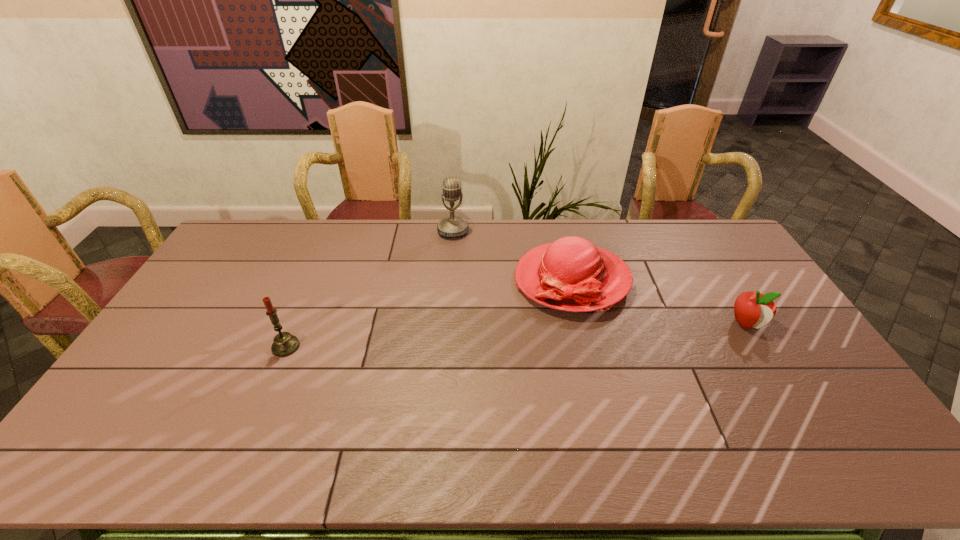
The height and width of the screenshot is (540, 960). What are the coordinates of `the leftmost object` in the screenshot? It's located at (285, 344).

Locate an element on the screen. The image size is (960, 540). candle is located at coordinates (285, 344).

Find the location of `apple`. apple is located at coordinates (752, 309).

Where is `the rightmost object`? Image resolution: width=960 pixels, height=540 pixels. the rightmost object is located at coordinates (752, 309).

Find the location of a particular element. The height and width of the screenshot is (540, 960). hat is located at coordinates (571, 274).

Where is `the second shortest object`? the second shortest object is located at coordinates (571, 274).

Identify the location of the second object from left to right. The height and width of the screenshot is (540, 960). (452, 226).

Locate an element on the screen. microphone is located at coordinates (452, 226).

I want to click on free space located on the back of the nearest object, so click(296, 325).

This screenshot has width=960, height=540. What are the coordinates of `vacant region located on the side where a bite is taken out of the apple` in the screenshot? It's located at (808, 423).